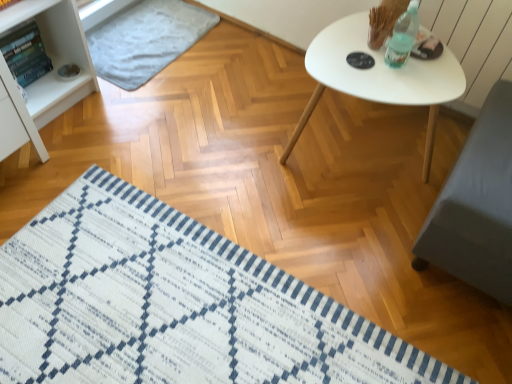
Image resolution: width=512 pixels, height=384 pixels. I want to click on vacant space that's between white matte table at upper right and light gray textured mat at upper left, positioned as the 1th mat in top-to-bottom order, so click(240, 87).